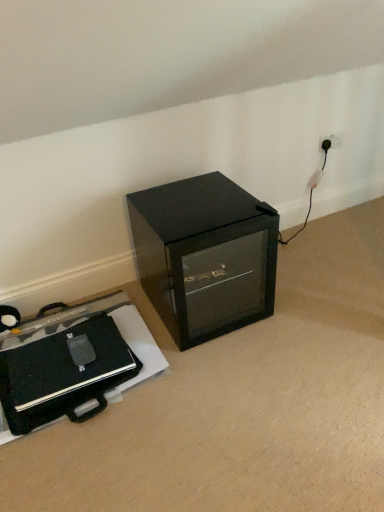
The width and height of the screenshot is (384, 512). What do you see at coordinates (204, 256) in the screenshot?
I see `black glass cabinet at center` at bounding box center [204, 256].

The width and height of the screenshot is (384, 512). What are the coordinates of `black glass cabinet at center` in the screenshot? It's located at (204, 256).

Where is `black matte briefcase at lower left`? Image resolution: width=384 pixels, height=512 pixels. black matte briefcase at lower left is located at coordinates (64, 373).

What do you see at coordinates (64, 373) in the screenshot?
I see `black matte briefcase at lower left` at bounding box center [64, 373].

Identify the location of black glass cabinet at center. The image size is (384, 512). [204, 256].

Considering the positions of objects black matte briefcase at lower left and black glass cabinet at center in the image provided, who is more to the right, black matte briefcase at lower left or black glass cabinet at center?

black glass cabinet at center is more to the right.

Is the depth of black matte briefcase at lower left less than that of black glass cabinet at center?

Yes, black matte briefcase at lower left is closer to the viewer.

Between point (45, 374) and point (147, 276), which one is positioned in front?

The point (45, 374) is more forward.

From the image's perspective, between black matte briefcase at lower left and black glass cabinet at center, who is located below?

black matte briefcase at lower left is shown below in the image.

From a real-world perspective, is black matte briefcase at lower left physically below black glass cabinet at center?

Yes, from a real-world perspective, black matte briefcase at lower left is beneath black glass cabinet at center.

Does black matte briefcase at lower left have a lesser width compared to black glass cabinet at center?

Yes.

Based on the photo, who is shorter, black matte briefcase at lower left or black glass cabinet at center?

black matte briefcase at lower left is shorter.

Between black matte briefcase at lower left and black glass cabinet at center, which one has smaller size?

With smaller size is black matte briefcase at lower left.

Is black matte briefcase at lower left spatially inside black glass cabinet at center, or outside of it?

black matte briefcase at lower left exists outside the volume of black glass cabinet at center.

Based on the photo, are black matte briefcase at lower left and black glass cabinet at center making contact?

No, black matte briefcase at lower left is not with black glass cabinet at center.

Is black matte briefcase at lower left facing towards black glass cabinet at center?

No, black matte briefcase at lower left is not oriented towards black glass cabinet at center.

How far apart are black matte briefcase at lower left and black glass cabinet at center?

They are 18.84 inches apart.

Identify the location of wide below the black glass cabinet at center (from the image's perspective). (64, 373).

Considering the relative positions of black glass cabinet at center and black matte briefcase at lower left in the image provided, is black glass cabinet at center to the left of black matte briefcase at lower left from the viewer's perspective?

Incorrect, black glass cabinet at center is not on the left side of black matte briefcase at lower left.

Considering the relative positions of black glass cabinet at center and black matte briefcase at lower left in the image provided, is black glass cabinet at center behind black matte briefcase at lower left?

Yes, it is behind black matte briefcase at lower left.

Between point (201, 336) and point (113, 354), which one is positioned behind?

Point (201, 336)

From the image's perspective, is black glass cabinet at center located above or below black matte briefcase at lower left?

Based on their image positions, black glass cabinet at center is located above black matte briefcase at lower left.

From a real-world perspective, which object rests below the other?

black matte briefcase at lower left, from a real-world perspective.

Considering the relative sizes of black glass cabinet at center and black matte briefcase at lower left in the image provided, is black glass cabinet at center wider than black matte briefcase at lower left?

Yes, black glass cabinet at center is wider than black matte briefcase at lower left.

Consider the image. Who is taller, black glass cabinet at center or black matte briefcase at lower left?

black glass cabinet at center.

Can you confirm if black glass cabinet at center is bigger than black matte briefcase at lower left?

Yes.

Is black glass cabinet at center not inside black matte briefcase at lower left?

Indeed, black glass cabinet at center is completely outside black matte briefcase at lower left.

Is black glass cabinet at center beside black matte briefcase at lower left?

No, black glass cabinet at center is not in contact with black matte briefcase at lower left.

Is black matte briefcase at lower left at the back of black glass cabinet at center?

That's not correct — black glass cabinet at center is not looking away from black matte briefcase at lower left.

Can you tell me how much black glass cabinet at center and black matte briefcase at lower left differ in facing direction?

There is a 0.321-degree angle between the facing directions of black glass cabinet at center and black matte briefcase at lower left.

Where is `furniture that is above the black matte briefcase at lower left (from the image's perspective)`? This screenshot has height=512, width=384. furniture that is above the black matte briefcase at lower left (from the image's perspective) is located at coordinates (204, 256).

The width and height of the screenshot is (384, 512). I want to click on furniture lying on the right of black matte briefcase at lower left, so click(x=204, y=256).

This screenshot has width=384, height=512. Identify the location of furniture above the black matte briefcase at lower left (from a real-world perspective). (204, 256).